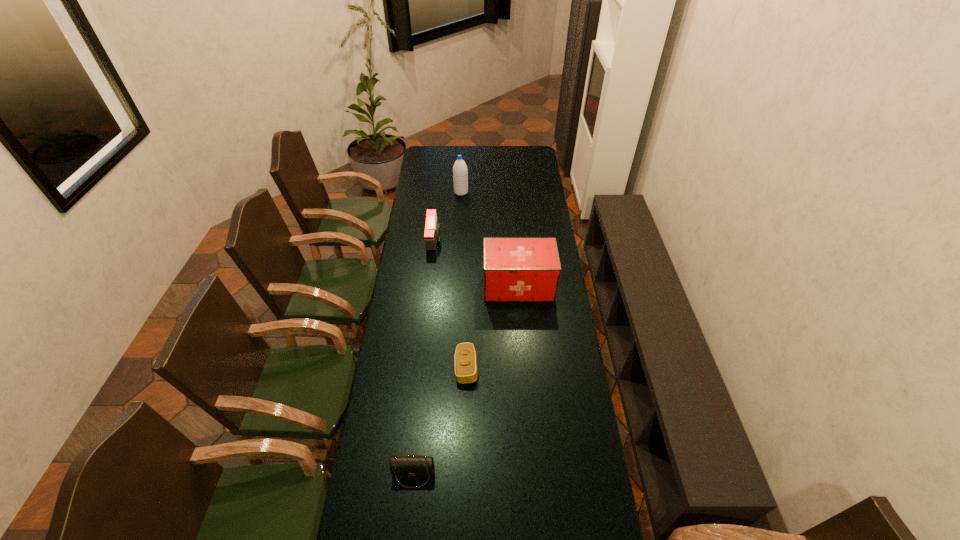
Locate an element on the screen. The image size is (960, 540). the farthest object is located at coordinates (460, 172).

Locate an element on the screen. the third farthest object is located at coordinates (515, 269).

The width and height of the screenshot is (960, 540). Find the location of `the first-aid kit`. the first-aid kit is located at coordinates (515, 269).

You are a GUI agent. You are given a task and a screenshot of the screen. Output one action in this format:
    pyautogui.click(x=<x>, y=<y>)
    Task: Click on the camera
    
    Given the screenshot: What is the action you would take?
    pyautogui.click(x=432, y=228)

Locate an element on the screen. This screenshot has width=960, height=540. the second farthest object is located at coordinates (432, 228).

Image resolution: width=960 pixels, height=540 pixels. I want to click on the nearer clutch bag, so click(409, 466).

I want to click on the nearest object, so click(x=409, y=466).

The height and width of the screenshot is (540, 960). Identify the location of the right clutch bag. (465, 355).

Where is `the second nearest object`? This screenshot has width=960, height=540. the second nearest object is located at coordinates (x=465, y=355).

Image resolution: width=960 pixels, height=540 pixels. In order to click on vacant point located on the right of the water bottle in this screenshot , I will do `click(518, 192)`.